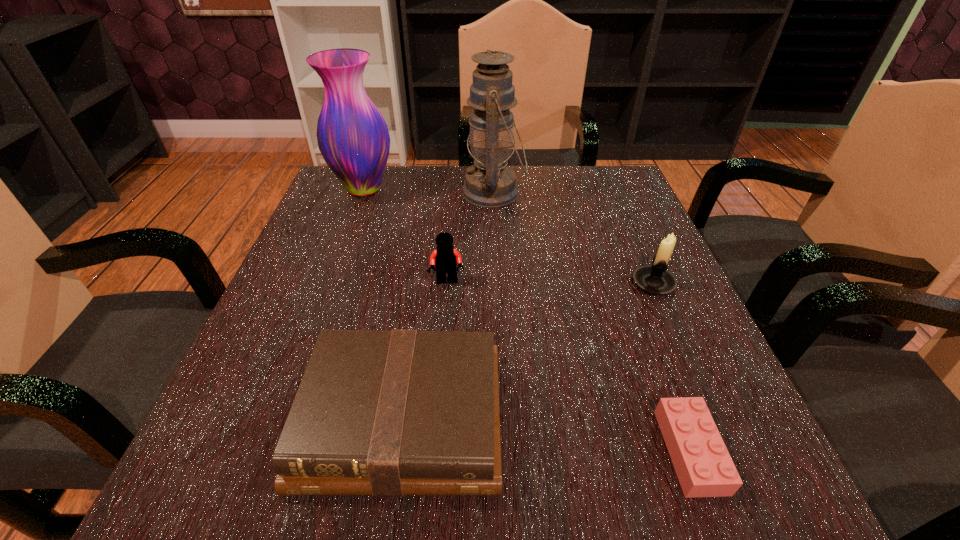
The width and height of the screenshot is (960, 540). What are the coordinates of `vacant region between the Bible and the vase` in the screenshot? It's located at (383, 304).

Where is `object that stands as the closest to the third shortest object`? object that stands as the closest to the third shortest object is located at coordinates (388, 413).

Locate an element on the screen. The width and height of the screenshot is (960, 540). the fifth closest object to the third tallest object is located at coordinates (353, 138).

Find the location of `vacant space that satisfies the following two spatial constraints: 1. on the front-facing side of the candle holder; 2. on the right side of the farther Lego`. vacant space that satisfies the following two spatial constraints: 1. on the front-facing side of the candle holder; 2. on the right side of the farther Lego is located at coordinates (447, 284).

Image resolution: width=960 pixels, height=540 pixels. What are the coordinates of `vacant position in the image that satisfies the following two spatial constraints: 1. on the spine side of the nearer Lego; 2. on the left side of the Bible` in the screenshot? It's located at (397, 451).

Where is `free location that satisfies the following two spatial constraints: 1. on the front side of the nearer Lego; 2. on the right side of the vase`? free location that satisfies the following two spatial constraints: 1. on the front side of the nearer Lego; 2. on the right side of the vase is located at coordinates (265, 451).